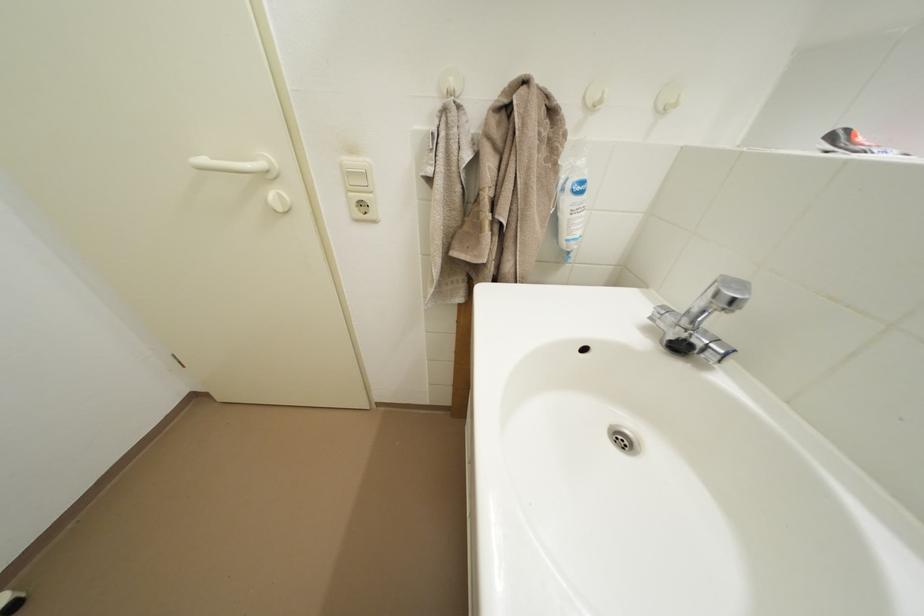
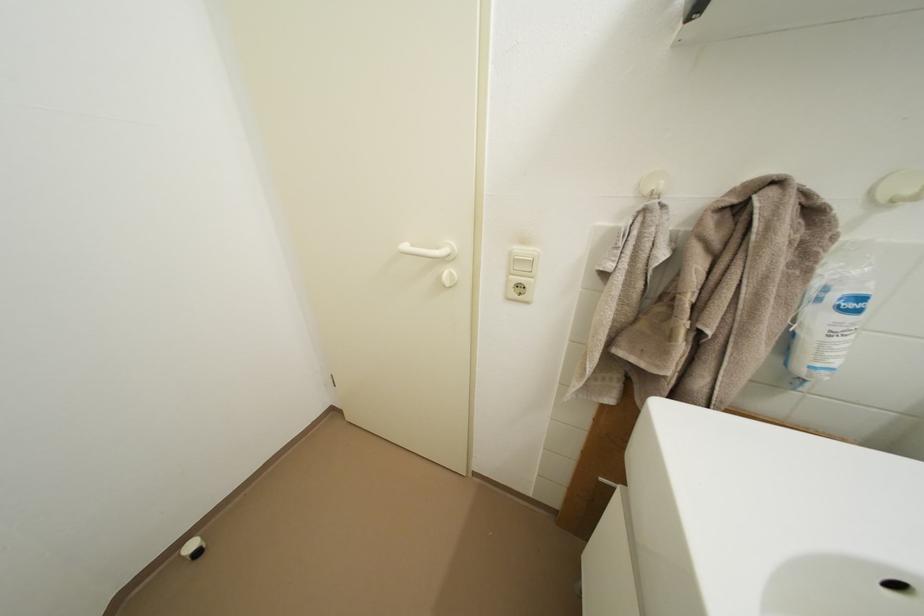
Question: Which direction would the cameraman need to move to produce the second image? Reply with the corresponding letter.

Choices:
 (A) Left
 (B) Right
 (C) Forward
 (D) Backward

Answer: (A)